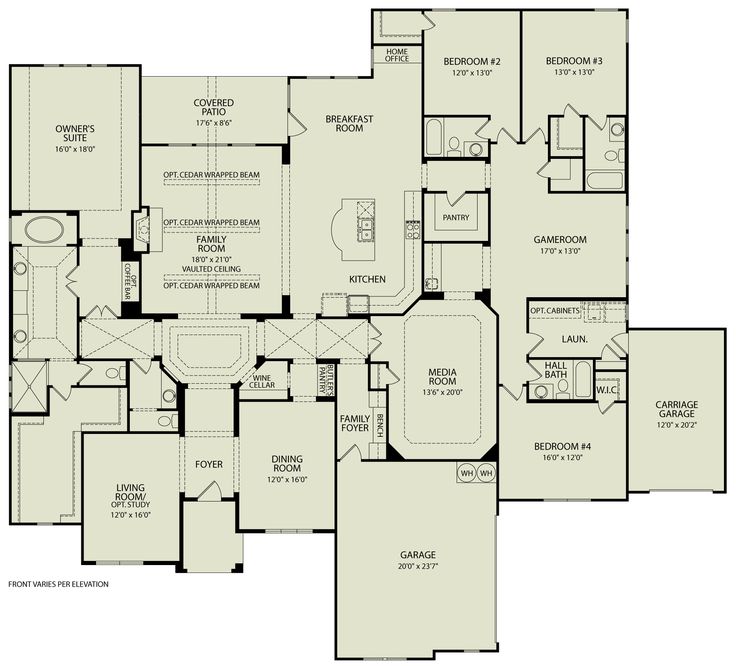
Locate an element on the screen. bedrooms is located at coordinates (575, 66), (472, 65), (77, 130), (567, 466).